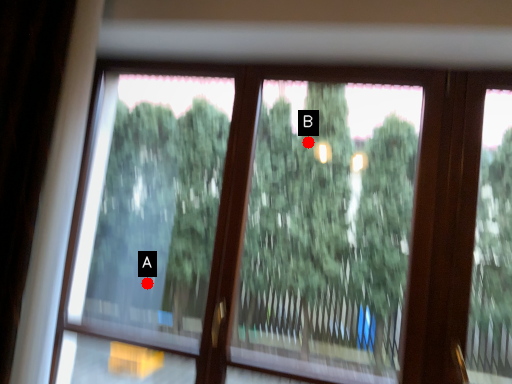
Question: Two points are circled on the image, labeled by A and B beside each circle. Which point is closer to the camera?

Choices:
 (A) A is closer
 (B) B is closer

Answer: (B)